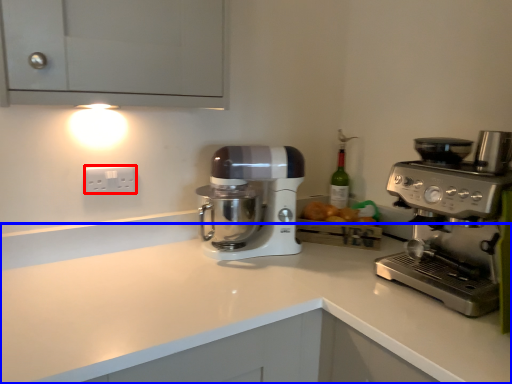
Question: Which object appears farthest to the camera in this image, electric outlet (highlighted by a red box) or counter top (highlighted by a blue box)?

Choices:
 (A) electric outlet
 (B) counter top

Answer: (A)